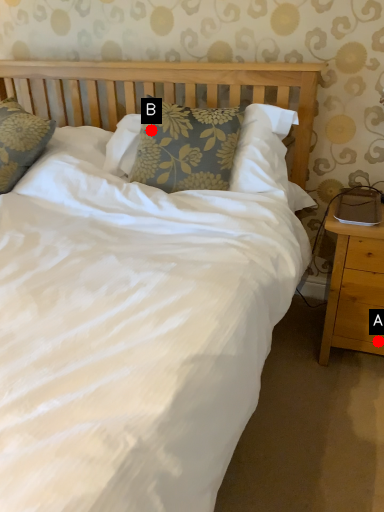
Question: Two points are circled on the image, labeled by A and B beside each circle. Among these points, which one is farthest from the camera?

Choices:
 (A) A is further
 (B) B is further

Answer: (B)